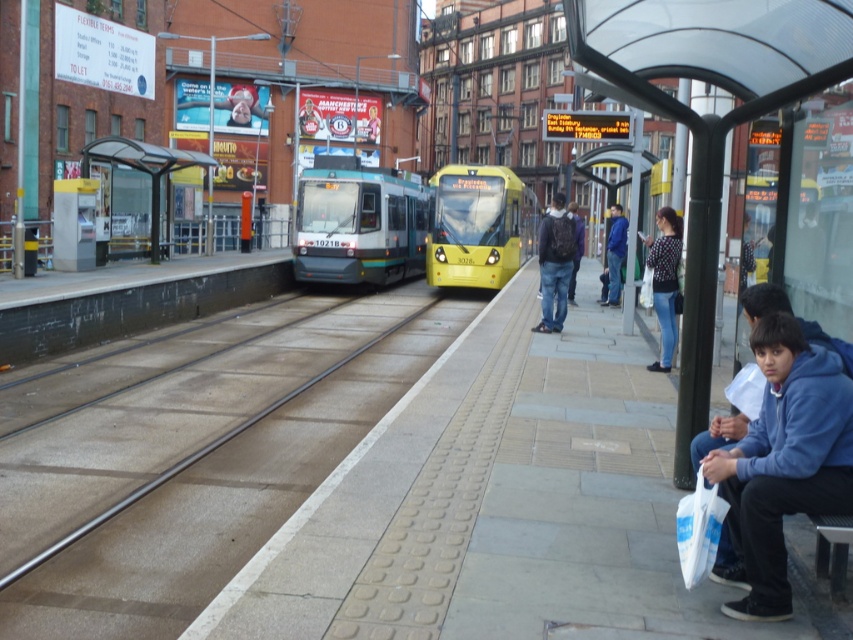
You are a photographer standing on the tram station platform. You want to take a photo of the blue fleece jacket at lower right and the dark blue jacket at center. Which jacket will appear smaller in the photo?

The blue fleece jacket at lower right is thinner than the dark blue jacket at center, so it will appear smaller in the photo.

You are a passenger waiting at the tram station. You want to board the yellow matte train at center but need to pass by the polka dot sweater at right. Can you walk straight ahead from your current position to reach the train without moving around the sweater?

The yellow matte train at center is to the left of the polka dot sweater at right, so you can walk straight ahead towards the train without needing to move around the sweater.

You are standing at the tram station and want to take a photo of the point at coordinates (323,157). If your camera has a maximum focus range of 25 meters, will it be able to focus on that point?

The point at coordinates (323,157) is 24.21 meters from the camera. Since this distance is within the camera maximum focus range of 25 meters, the camera can focus on that point.